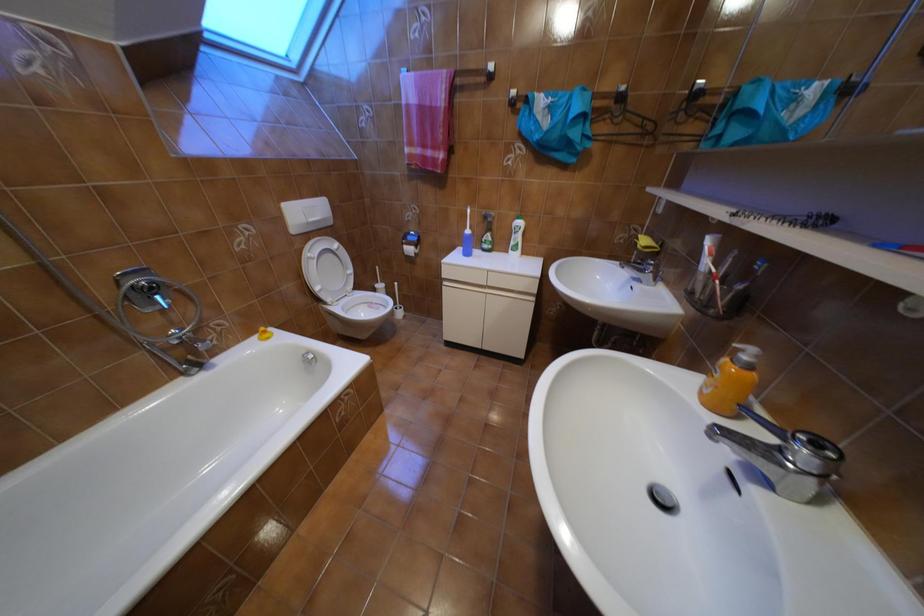
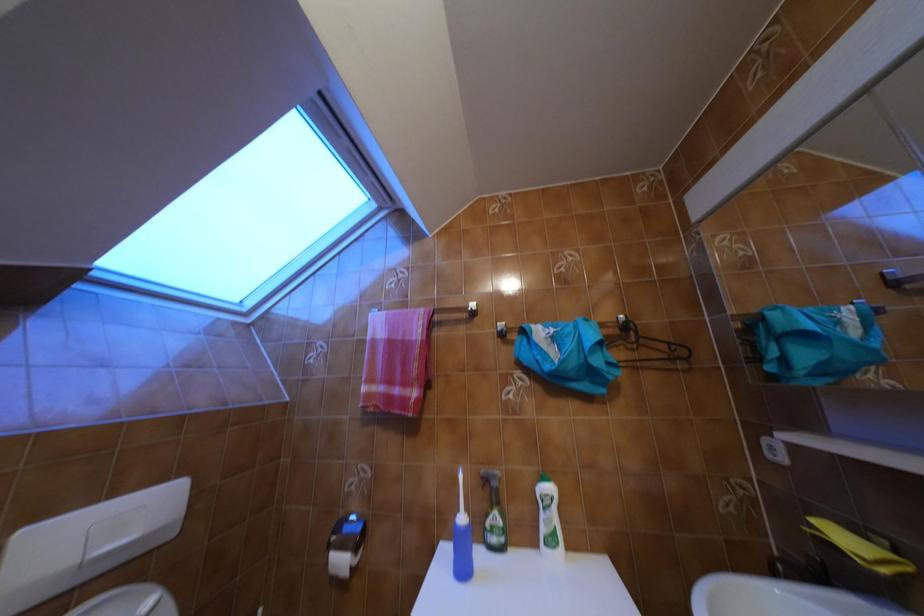
Question: The first image is from the beginning of the video and the second image is from the end. How did the camera likely rotate when shooting the video?

Choices:
 (A) Left
 (B) Right
 (C) Up
 (D) Down

Answer: (C)